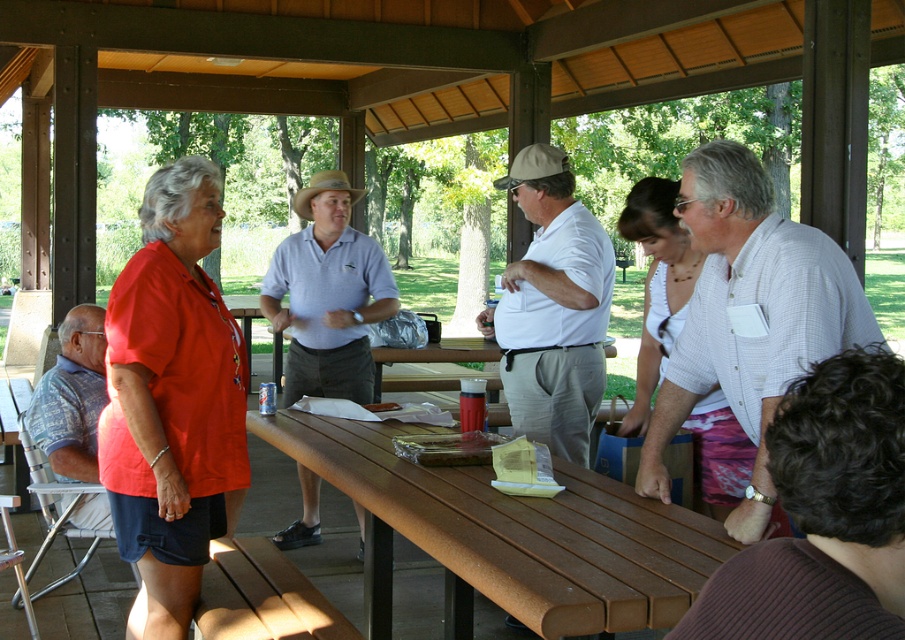
Between brown wood picnic table at center and matte white shirt at center, which one is positioned higher?

matte white shirt at center is above.

Between brown wood picnic table at center and matte white shirt at center, which one has more height?

With more height is matte white shirt at center.

Between point (624, 520) and point (527, 320), which one is positioned behind?

Point (527, 320)

The image size is (905, 640). Find the location of `brown wood picnic table at center`. brown wood picnic table at center is located at coordinates (510, 534).

Can you confirm if white checkered shirt at center is positioned to the left of matte white shirt at center?

No, white checkered shirt at center is not to the left of matte white shirt at center.

Between white checkered shirt at center and matte white shirt at center, which one has less height?

Standing shorter between the two is white checkered shirt at center.

Who is more distant from viewer, (702, 193) or (539, 333)?

Positioned behind is point (539, 333).

Identify the location of white checkered shirt at center. click(749, 316).

Between point (679, 192) and point (62, 401), which one is positioned behind?

The point (62, 401) is more distant.

Is point (854, 305) more distant than point (58, 424)?

That is False.

This screenshot has height=640, width=905. Find the location of `white checkered shirt at center`. white checkered shirt at center is located at coordinates (749, 316).